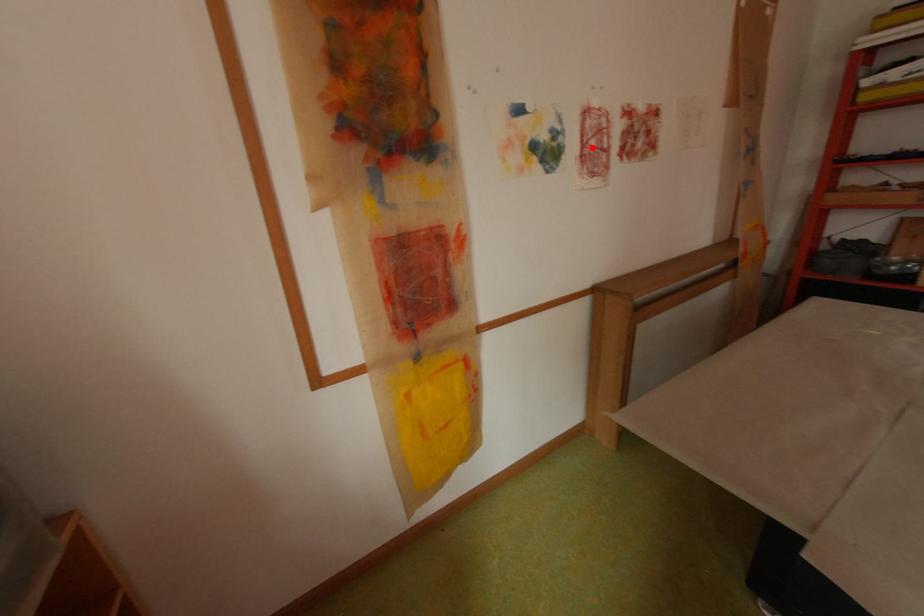
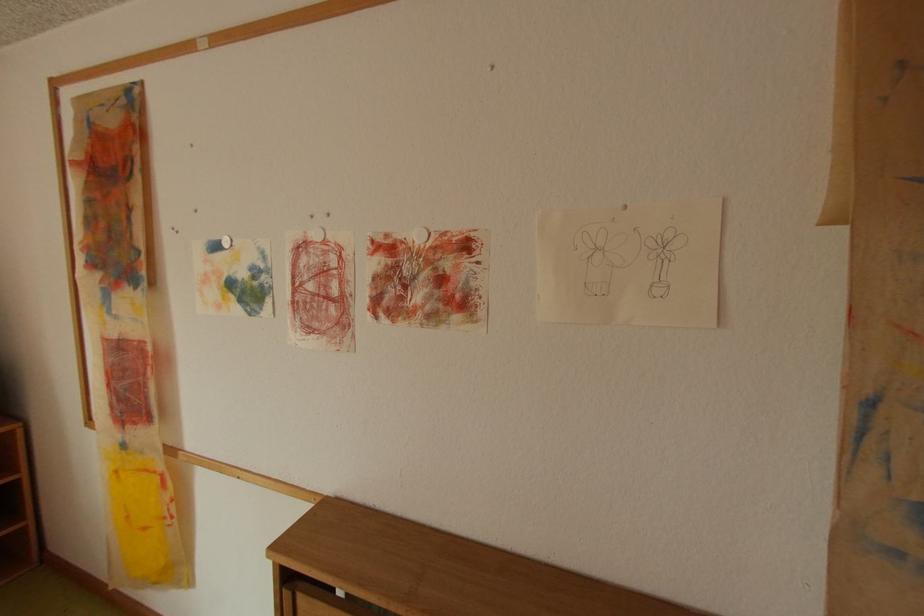
Locate, in the second image, the point that corresponds to the highlighted location in the first image.

(304, 292)